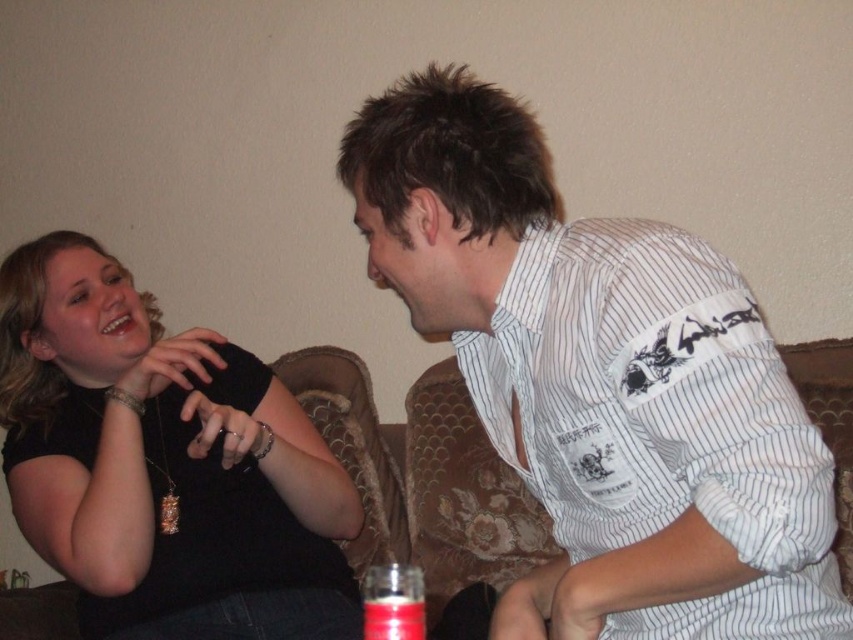
Can you confirm if white striped shirt at upper right is shorter than black matte necklace at upper left?

Yes, white striped shirt at upper right is shorter than black matte necklace at upper left.

Who is positioned more to the right, white striped shirt at upper right or black matte necklace at upper left?

Positioned to the right is white striped shirt at upper right.

Is point (497, 154) positioned in front of point (187, 358)?

Yes, point (497, 154) is in front of point (187, 358).

Locate an element on the screen. This screenshot has width=853, height=640. white striped shirt at upper right is located at coordinates (601, 381).

Can you confirm if black matte necklace at upper left is positioned to the right of translucent glass bottle at lower center?

No, black matte necklace at upper left is not to the right of translucent glass bottle at lower center.

From the picture: Does black matte necklace at upper left have a larger size compared to translucent glass bottle at lower center?

Indeed, black matte necklace at upper left has a larger size compared to translucent glass bottle at lower center.

At what (x,y) coordinates should I click in order to perform the action: click on black matte necklace at upper left. Please return your answer as a coordinate pair (x, y). Looking at the image, I should click on (163, 464).

Is point (357, 632) behind point (431, 493)?

No, it is in front of (431, 493).

Consider the image. Is black matte necklace at upper left to the right of velvet floral couch at center from the viewer's perspective?

No, black matte necklace at upper left is not to the right of velvet floral couch at center.

Is point (215, 461) farther from viewer compared to point (815, 406)?

Yes, point (215, 461) is behind point (815, 406).

This screenshot has width=853, height=640. Identify the location of black matte necklace at upper left. (163, 464).